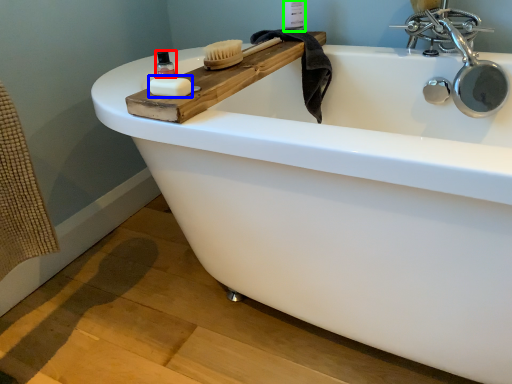
Question: Which is farther away from mouthwash (highlighted by a red box)? soap (highlighted by a blue box) or toiletry (highlighted by a green box)?

Choices:
 (A) soap
 (B) toiletry

Answer: (B)